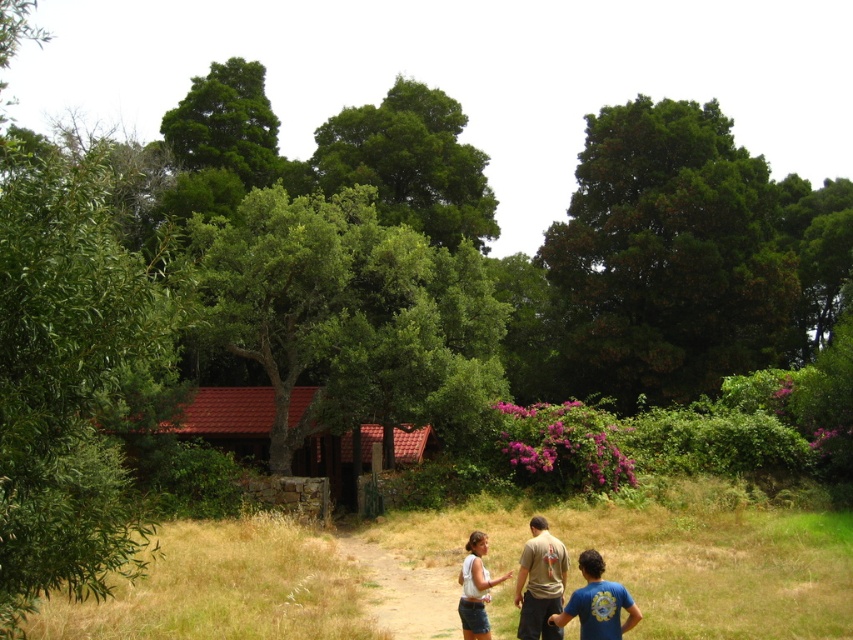
You are standing at the center of the dirt path in the scene. Which direction should you look to see the green leafy tree at left?

The green leafy tree at left is located at point coordinates of 0.586 on the x axis and 0.084 on the y axis, so you should look to your left side to see it.

You are an artist trying to sketch this scene. You notice the green leafy tree at upper right and the white cotton shirt at center. Which object is wider in the image?

The green leafy tree at upper right is wider than the white cotton shirt at center according to the description.

Based on the photo, you are a hiker walking along the dirt path and notice the green leafy tree at upper right and the white cotton shirt at center. Which object is located higher up in the scene?

The green leafy tree at upper right is positioned over the white cotton shirt at center, so it is higher up in the scene.